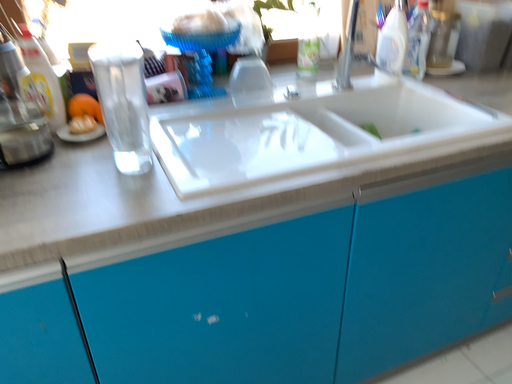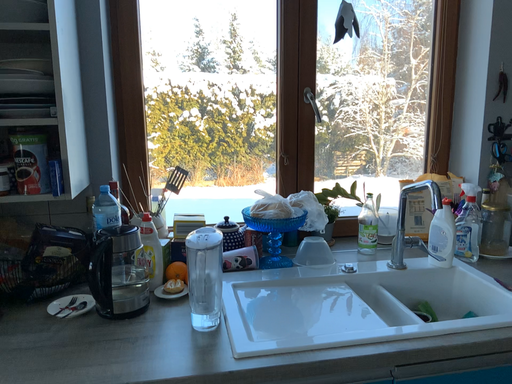
Question: How did the camera likely rotate when shooting the video?

Choices:
 (A) rotated downward
 (B) rotated upward

Answer: (B)